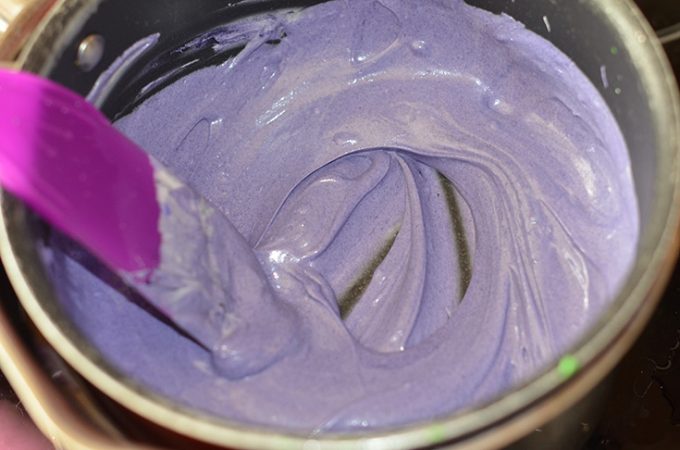
This screenshot has height=450, width=680. In order to click on round container in this screenshot , I will do `click(641, 293)`.